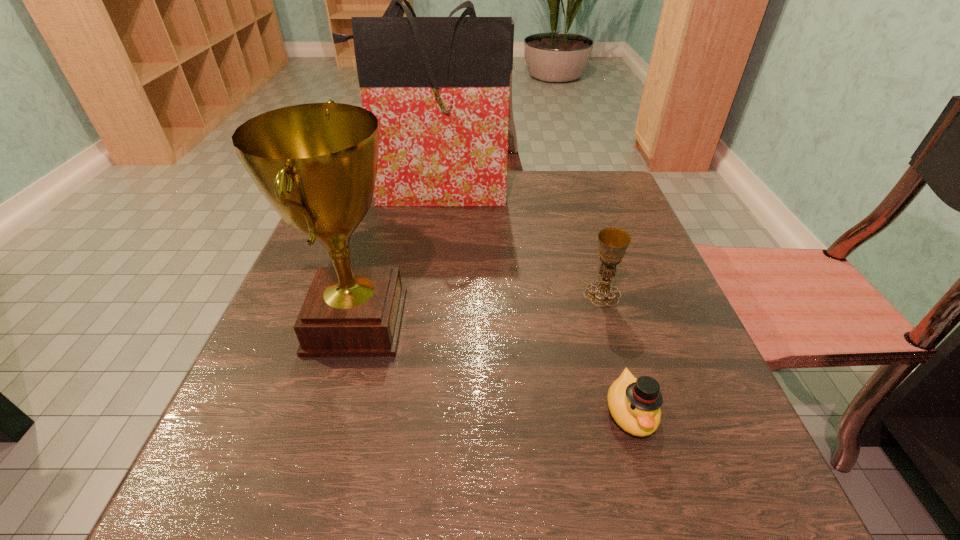
You are a GUI agent. You are given a task and a screenshot of the screen. Output one action in this format:
    pyautogui.click(x=<x>, y=<y>)
    Task: Click on the vacant space at the near right corner
    Image resolution: width=960 pixels, height=540 pixels.
    Given the screenshot: What is the action you would take?
    pyautogui.click(x=653, y=494)

Locate an element on the screen. free spot between the duck and the third tallest object is located at coordinates (616, 353).

Locate an element on the screen. The image size is (960, 540). empty space that is in between the third shortest object and the chalice is located at coordinates (480, 308).

What are the coordinates of `unoccupied area between the second shortest object and the shopping bag` in the screenshot? It's located at (518, 244).

Find the location of a particular element. The width and height of the screenshot is (960, 540). free area in between the third shortest object and the tallest object is located at coordinates (396, 257).

The width and height of the screenshot is (960, 540). What are the coordinates of `unoccupied area between the tallest object and the chalice` in the screenshot? It's located at (518, 244).

This screenshot has width=960, height=540. Identify the location of free point between the award and the shortest object. (493, 367).

Image resolution: width=960 pixels, height=540 pixels. I want to click on vacant space that's between the shortest object and the third shortest object, so click(493, 367).

Locate an element on the screen. blank region between the duck and the award is located at coordinates (493, 367).

Where is `free space between the award and the shortest object`? The width and height of the screenshot is (960, 540). free space between the award and the shortest object is located at coordinates (493, 367).